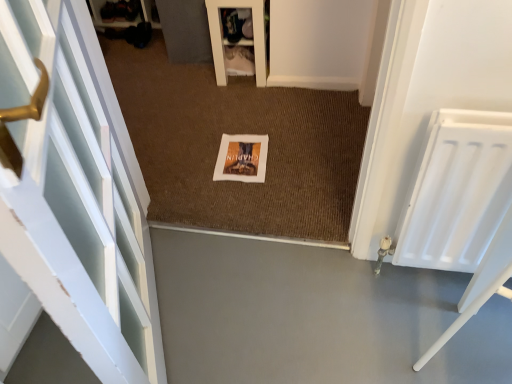
Where is `free space above white matte picture frame at center (from a real-world perspective)`? This screenshot has height=384, width=512. free space above white matte picture frame at center (from a real-world perspective) is located at coordinates (241, 154).